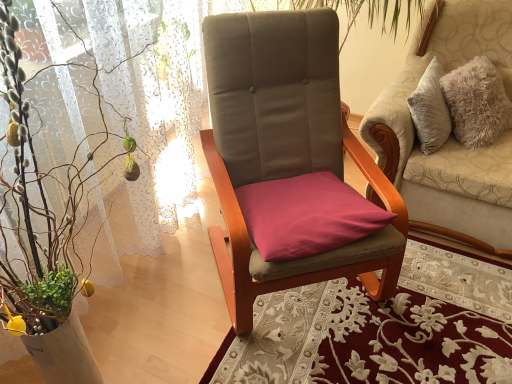
Question: From the image's perspective, is green leafy plant at left above or below purple fabric cushion at center?

Choices:
 (A) below
 (B) above

Answer: (A)

Question: From a real-world perspective, is green leafy plant at left positioned above or below purple fabric cushion at center?

Choices:
 (A) above
 (B) below

Answer: (A)

Question: Which object is the farthest from the purple fabric cushion at center?

Choices:
 (A) green leafy plant at left
 (B) velvet beige chair at center, positioned as the first chair in right-to-left order
 (C) suede-like beige chair at center, marked as the second chair in a right-to-left arrangement

Answer: (B)

Question: Which object is positioned closest to the velvet beige chair at center, positioned as the first chair in right-to-left order?

Choices:
 (A) green leafy plant at left
 (B) purple fabric cushion at center
 (C) suede-like beige chair at center, the 1th chair when ordered from left to right

Answer: (C)